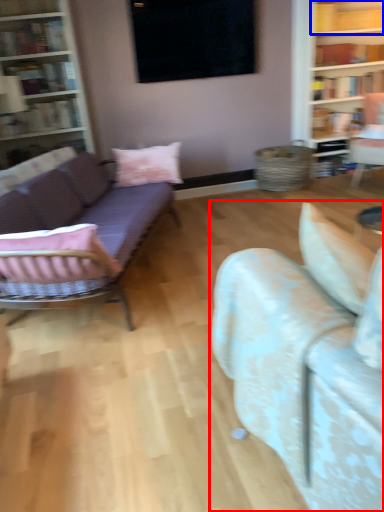
Question: Among these objects, which one is farthest to the camera, studio couch (highlighted by a red box) or shelf (highlighted by a blue box)?

Choices:
 (A) studio couch
 (B) shelf

Answer: (B)